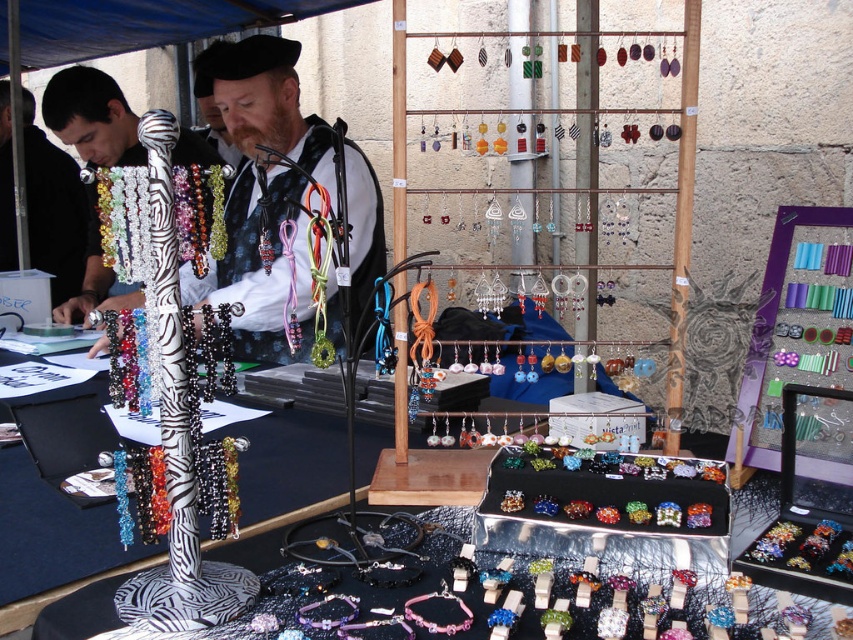
This screenshot has height=640, width=853. Find the location of `matte black vest at center`. matte black vest at center is located at coordinates pos(267,188).

Is matte black vest at center below multicolored beaded bracelet at center?

No, matte black vest at center is not below multicolored beaded bracelet at center.

Is point (271, 93) more distant than point (236, 524)?

Yes.

Find the location of a particular element. Image resolution: width=853 pixels, height=640 pixels. matte black vest at center is located at coordinates (267, 188).

Does matte black vest at center appear over matte black shirt at left?

Incorrect, matte black vest at center is not positioned above matte black shirt at left.

Is point (380, 209) positioned behind point (45, 236)?

No, it is in front of (45, 236).

Is point (251, 168) positioned after point (53, 216)?

No, (251, 168) is in front of (53, 216).

The height and width of the screenshot is (640, 853). Identify the location of matte black vest at center. (267, 188).

Describe the element at coordinates (53, 209) in the screenshot. The width and height of the screenshot is (853, 640). I see `matte black shirt at left` at that location.

Describe the element at coordinates (53, 209) in the screenshot. The image size is (853, 640). I see `matte black shirt at left` at that location.

Identify the location of matte black shirt at left. This screenshot has height=640, width=853. (53, 209).